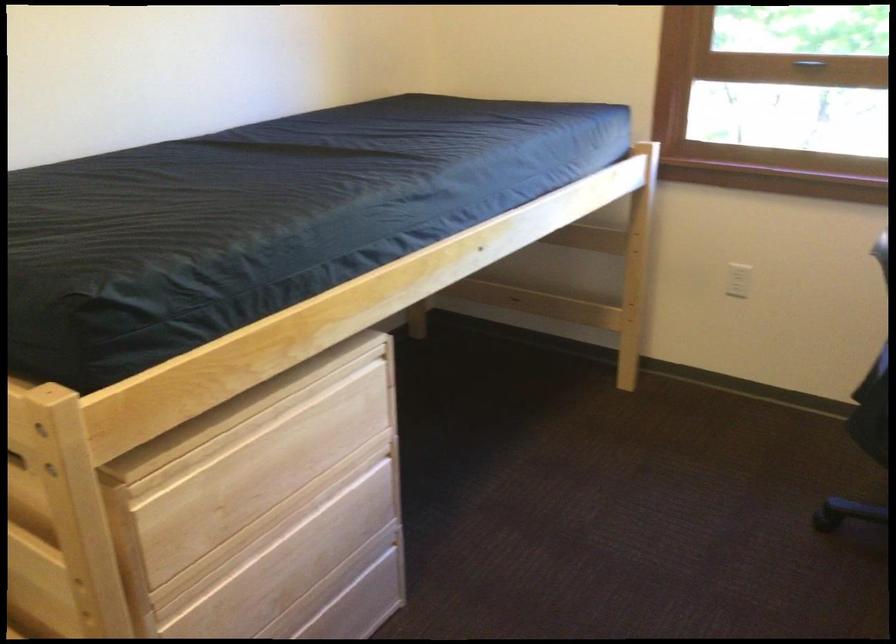
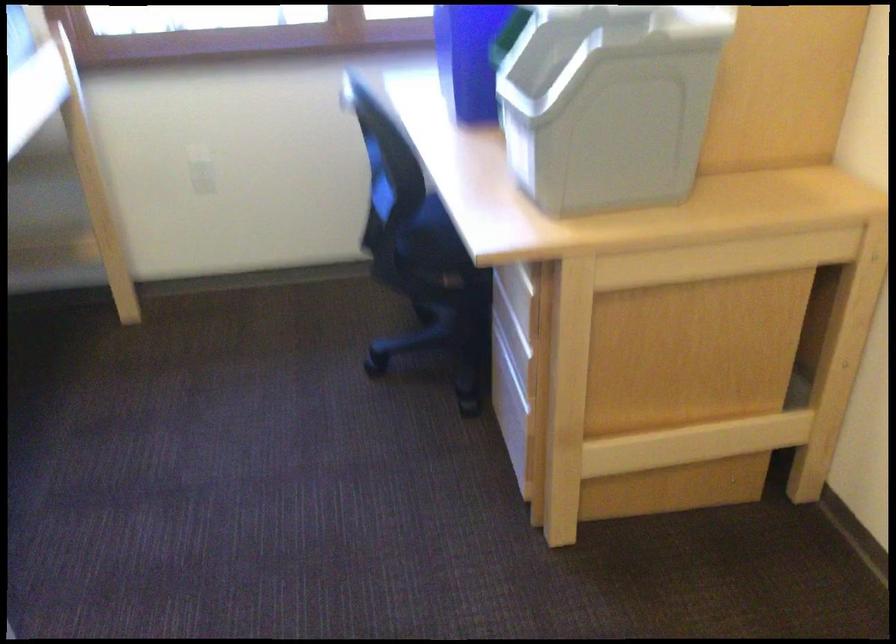
Question: The camera is either moving clockwise (left) or counter-clockwise (right) around the object. The first image is from the beginning of the video and the second image is from the end. Is the camera moving left or right when shooting the video?

Choices:
 (A) Left
 (B) Right

Answer: (A)